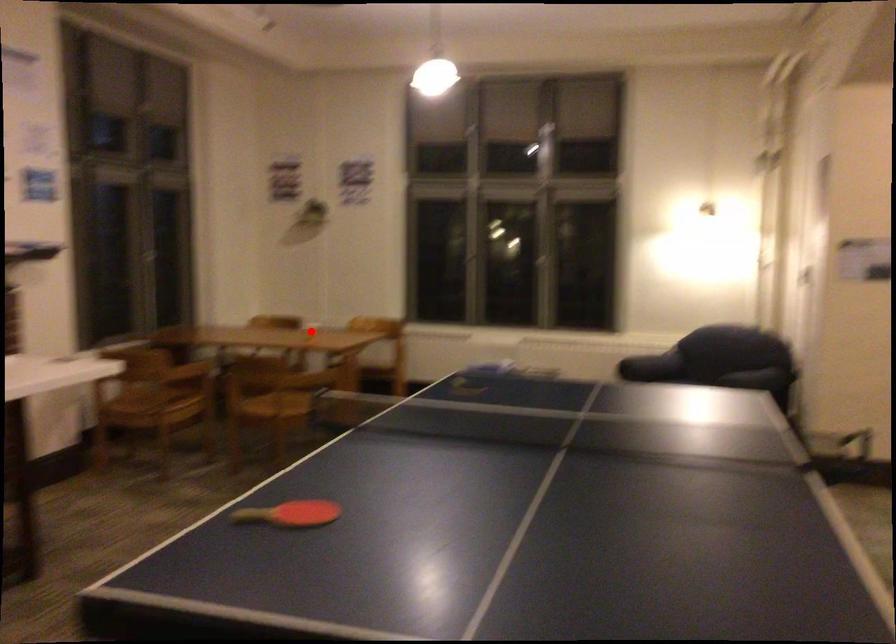
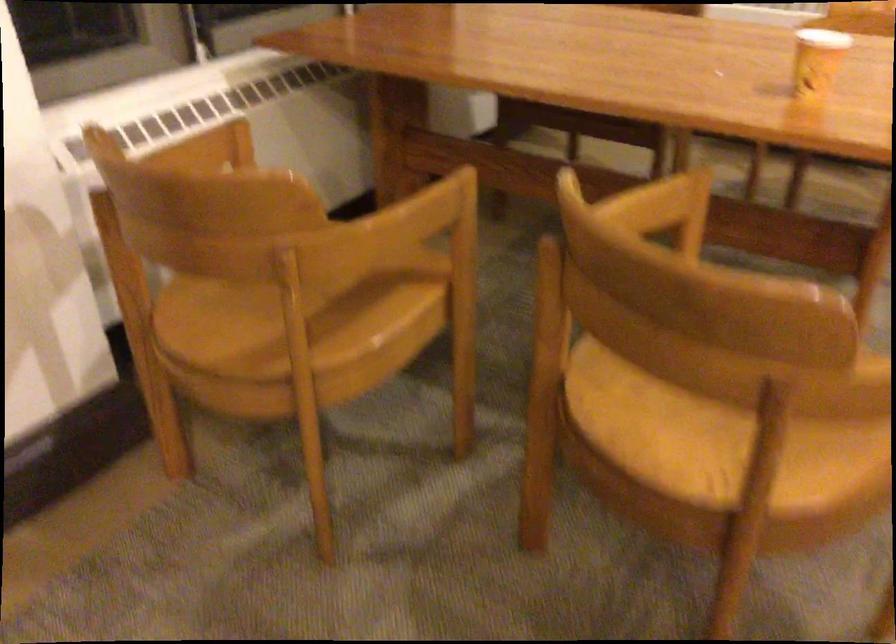
Locate, in the second image, the point that corresponds to the highlighted location in the first image.

(816, 61)